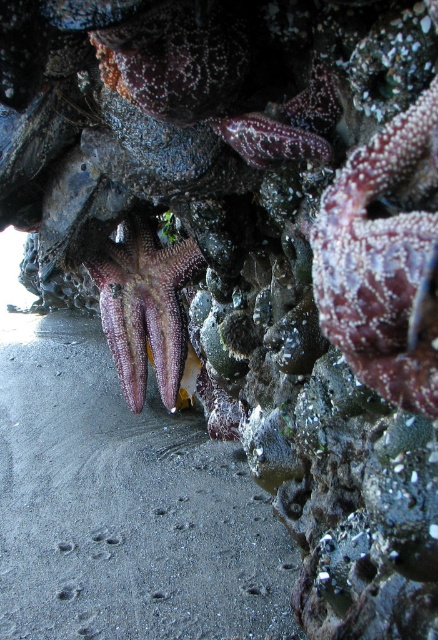
Question: Estimate the real-world distances between objects in this image. Which object is closer to the pearly white starfish at center?

Choices:
 (A) smooth sand at lower left
 (B) rough textured starfish at center

Answer: (A)

Question: Does rough textured starfish at center have a smaller size compared to pearly white starfish at center?

Choices:
 (A) no
 (B) yes

Answer: (B)

Question: Which of these objects is positioned closest to the rough textured starfish at center?

Choices:
 (A) smooth sand at lower left
 (B) pearly white starfish at center

Answer: (B)

Question: Can you confirm if smooth sand at lower left is positioned below rough textured starfish at center?

Choices:
 (A) no
 (B) yes

Answer: (B)

Question: Is smooth sand at lower left further to the viewer compared to rough textured starfish at center?

Choices:
 (A) no
 (B) yes

Answer: (B)

Question: Which object is closer to the camera taking this photo?

Choices:
 (A) pearly white starfish at center
 (B) smooth sand at lower left

Answer: (B)